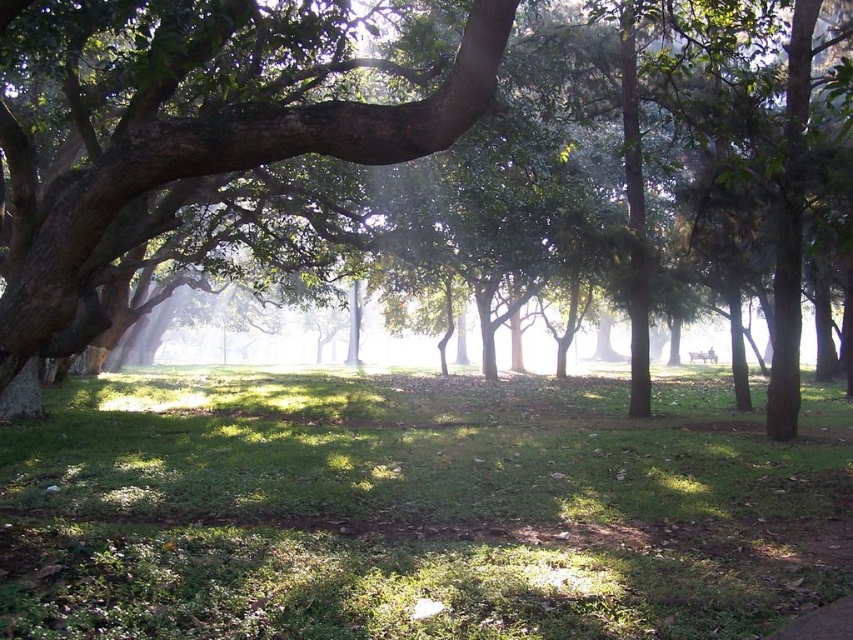
The image size is (853, 640). Find the location of `green grassy at center`. green grassy at center is located at coordinates (416, 508).

Based on the photo, does green grassy at center have a lesser height compared to green leafy tree at center?

Yes.

Identify the location of green grassy at center. The image size is (853, 640). (416, 508).